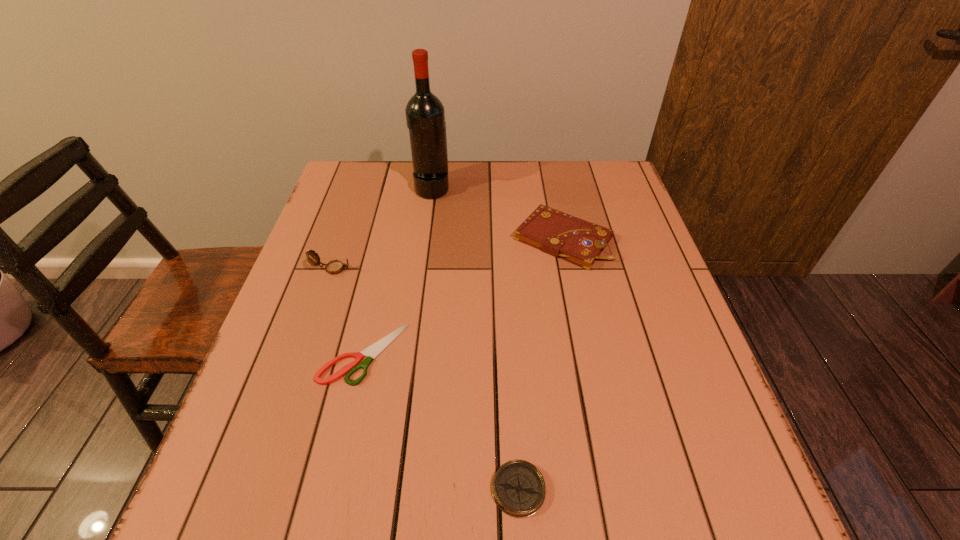
This screenshot has height=540, width=960. Identify the location of vacant area situated on the face of the taller compass. (372, 269).

Identify the location of free spot located on the front of the third tallest object. (574, 295).

This screenshot has width=960, height=540. I want to click on vacant space located 0.300m on the left of the fourth tallest object, so click(308, 489).

Locate an element on the screen. The width and height of the screenshot is (960, 540). free space located on the right of the shortest object is located at coordinates (580, 354).

Locate an element on the screen. object that is at the far edge is located at coordinates (425, 116).

Identify the location of object present at the near edge. This screenshot has height=540, width=960. (518, 488).

You are a GUI agent. You are given a task and a screenshot of the screen. Output one action in this format:
    pyautogui.click(x=<x>, y=<y>)
    Task: Click on the compass that is at the left edge
    The width and height of the screenshot is (960, 540).
    Given the screenshot: What is the action you would take?
    pyautogui.click(x=334, y=267)

The height and width of the screenshot is (540, 960). I want to click on scissors at the left edge, so click(x=371, y=352).

You are a GUI agent. You are given a task and a screenshot of the screen. Output one action in this format:
    pyautogui.click(x=<x>, y=<y>)
    Task: Click on the object located at the right edge
    This screenshot has width=960, height=540.
    Given the screenshot: What is the action you would take?
    pyautogui.click(x=580, y=242)

This screenshot has height=540, width=960. Identify the location of vacant space at the far edge of the desktop. (475, 169).